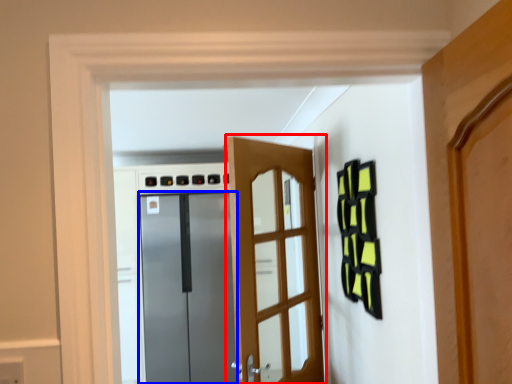
Question: Which object appears farthest to the camera in this image, door (highlighted by a red box) or door (highlighted by a blue box)?

Choices:
 (A) door
 (B) door

Answer: (B)